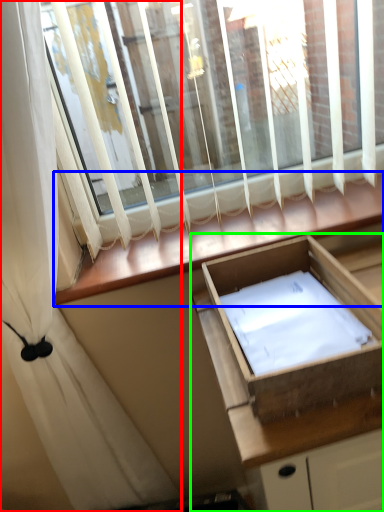
Question: Considering the real-world distances, which object is closest to curtain (highlighted by a red box)? window sill (highlighted by a blue box) or cabinetry (highlighted by a green box).

Choices:
 (A) window sill
 (B) cabinetry

Answer: (A)